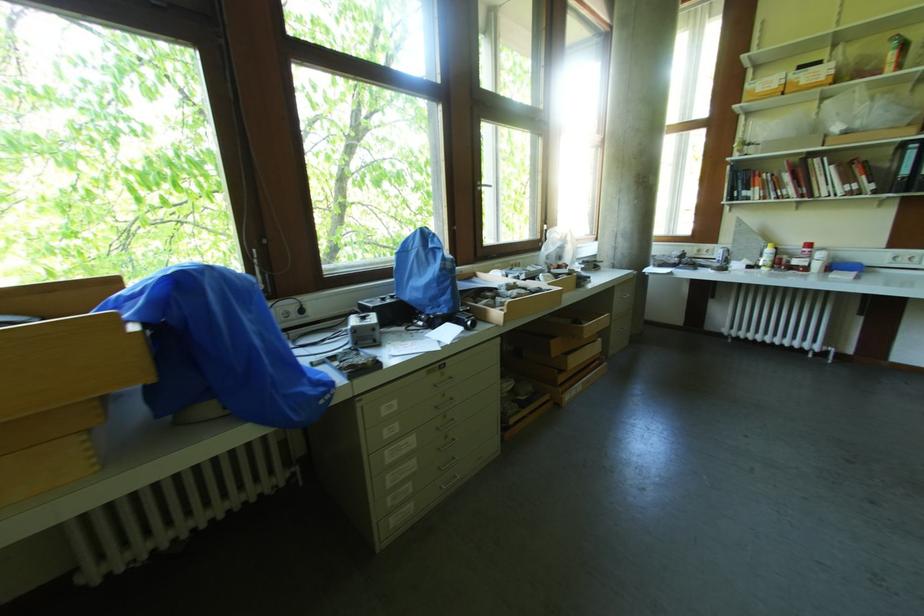
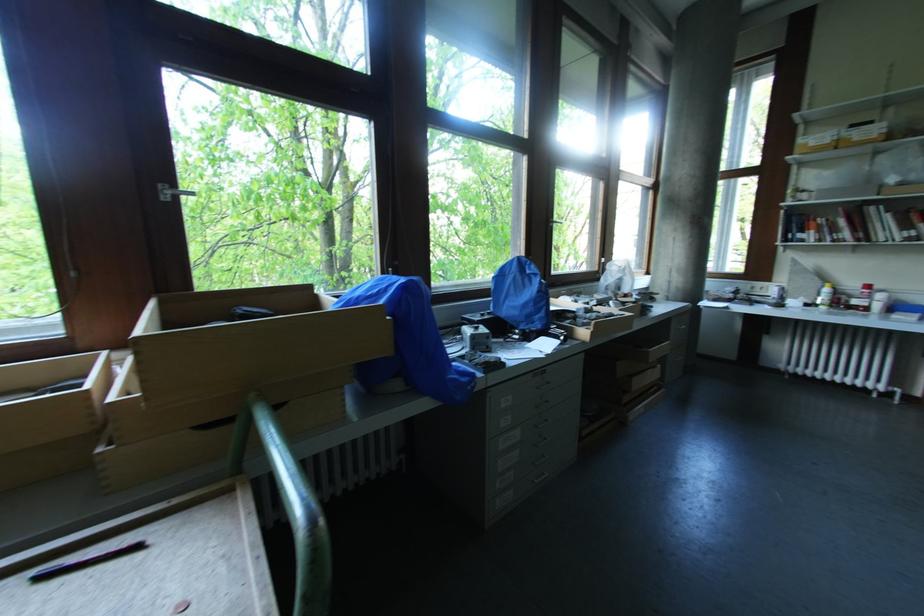
The point at (x=822, y=257) is marked in the first image. Where is the corresponding point in the second image?

(882, 298)